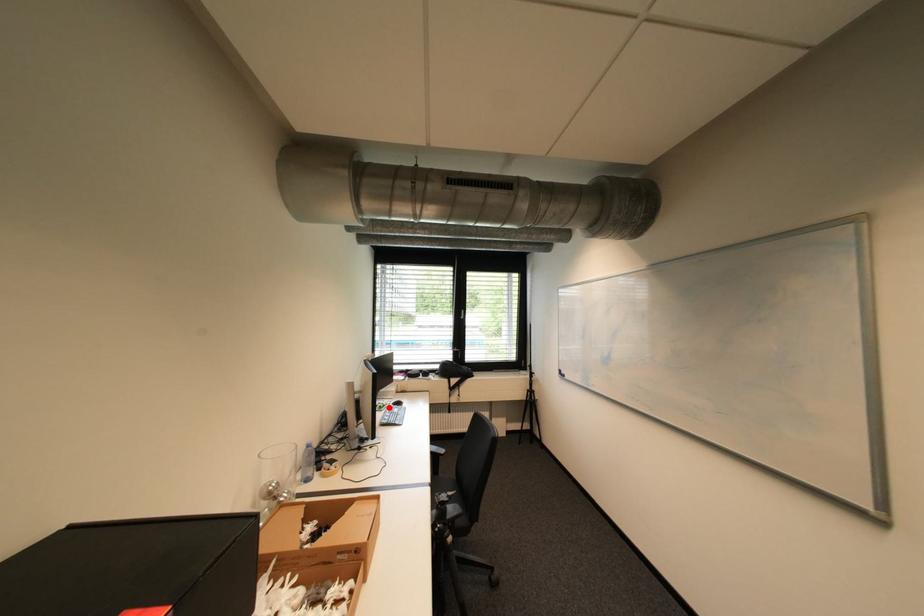
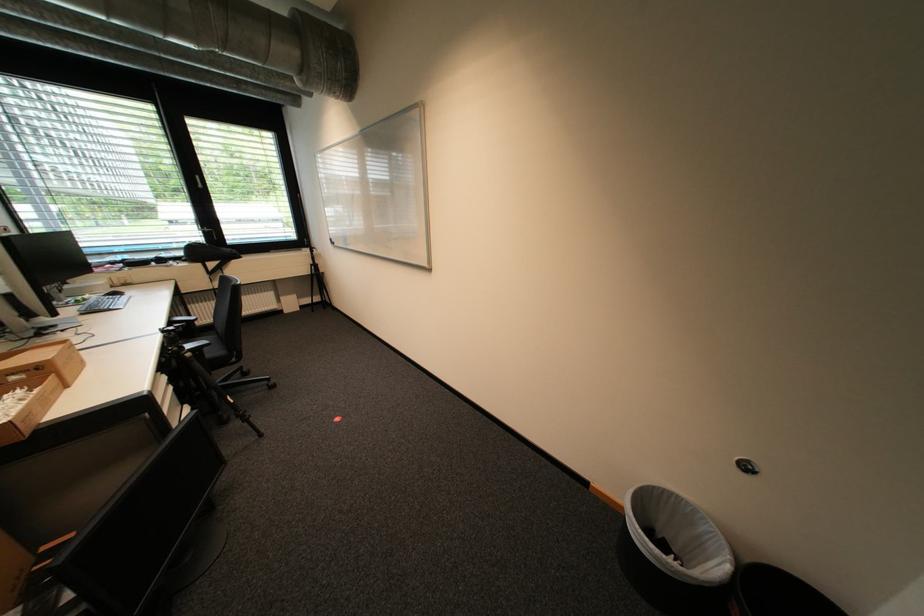
Question: I am providing you with two images of the same scene from different viewpoints. Image1 has a red point marked. In image2, the corresponding 3D location appears at what relative position? Reply with the corresponding letter.

Choices:
 (A) Closer
 (B) Farther

Answer: (B)